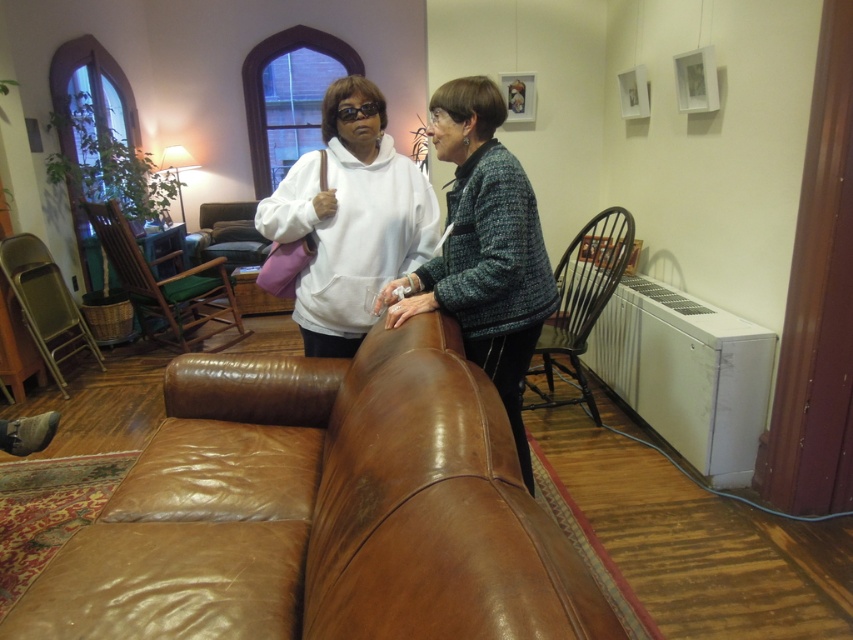
You are trying to decide where to place a new small side table in the living room. The table is 1.2 meters wide. Considering the space between the matte brown leather couch at center and the white matte hoodie at center, can the table fit there?

The matte brown leather couch at center is bigger than the white matte hoodie at center, but the exact distance between them isn

You are standing in the living room and see two points marked in the scene. Which point is closer to you, point (306, 273) or point (65, 355)?

Point (306, 273) is closer to the viewer than point (65, 355).